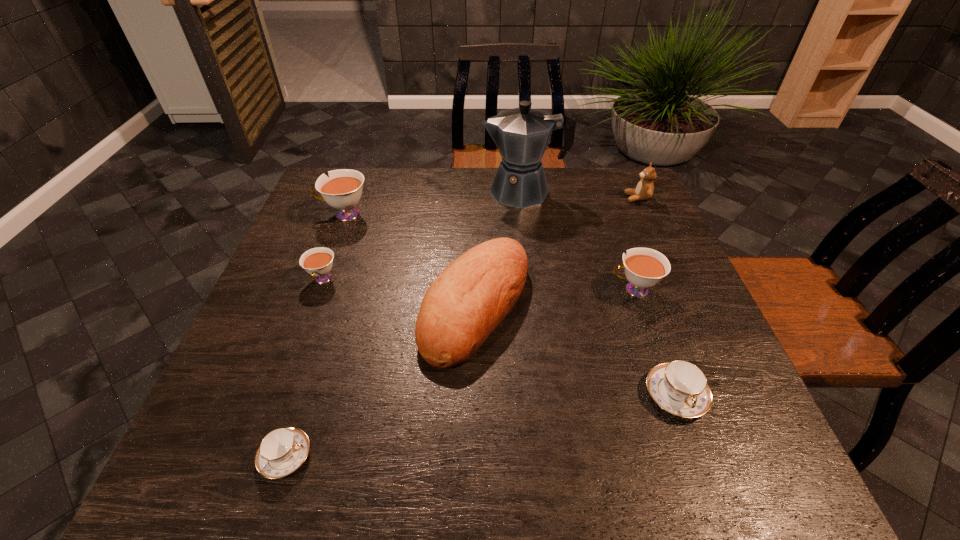
At what (x,y) coordinates should I click in order to perform the action: click on object at the far left corner. Please return your answer as a coordinate pair (x, y). This screenshot has height=540, width=960. Looking at the image, I should click on (x=342, y=190).

Where is `object at the near left corner`? This screenshot has width=960, height=540. object at the near left corner is located at coordinates (282, 451).

The height and width of the screenshot is (540, 960). What are the coordinates of `object that is at the far right corner` in the screenshot? It's located at (644, 190).

I want to click on vacant area at the far edge of the desktop, so click(393, 168).

Identify the location of vacant area at the near edge of the desktop. (308, 458).

You are a GUI agent. You are given a task and a screenshot of the screen. Output one action in this format:
    pyautogui.click(x=<x>, y=<y>)
    Task: Click on the blank space at the left edge
    Image resolution: width=960 pixels, height=540 pixels.
    Given the screenshot: What is the action you would take?
    pyautogui.click(x=327, y=220)

Find the location of a particular element. free space at the right edge of the desktop is located at coordinates tap(609, 218).

In the image, there is a desktop. In order to click on vacant region at the far right corner in this screenshot , I will do `click(616, 197)`.

Where is `free space between the smaller blue teacup and the bread`? The height and width of the screenshot is (540, 960). free space between the smaller blue teacup and the bread is located at coordinates (380, 381).

Where is `empty space between the biggest white teacup and the light bread`? The width and height of the screenshot is (960, 540). empty space between the biggest white teacup and the light bread is located at coordinates (410, 260).